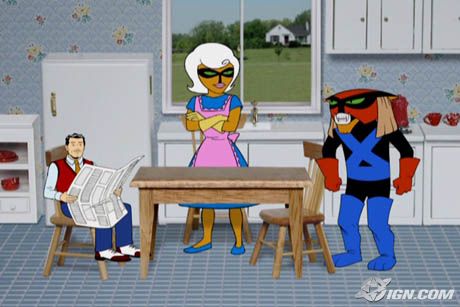
Identify the location of chairs. (57, 220), (190, 219), (277, 220).